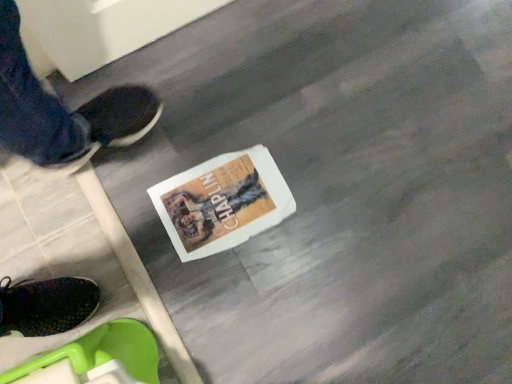
Locate an element on the screen. This screenshot has height=384, width=512. unoccupied space behind white paper magazine at center is located at coordinates (237, 112).